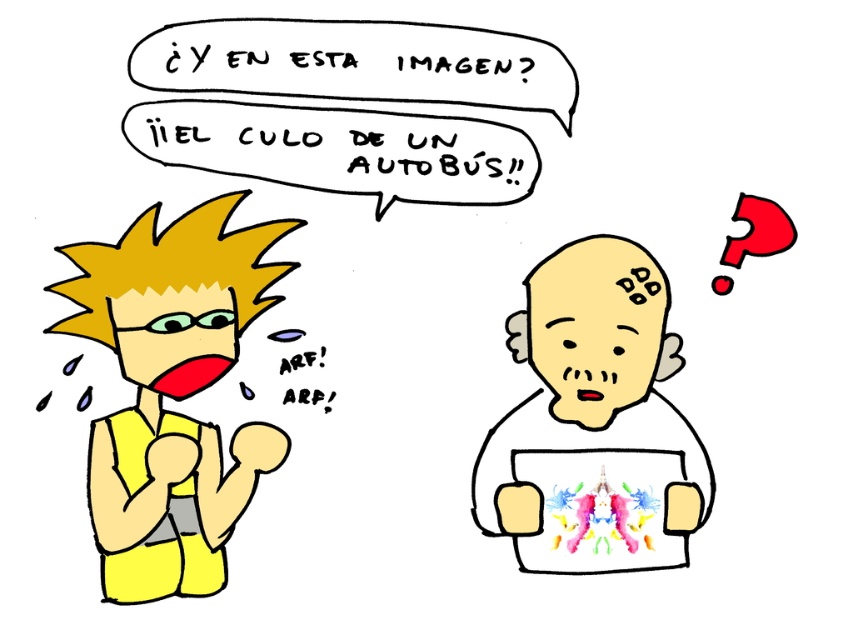
You are an AI analyzing the cartoon image. The scene has two characters. One is the character on the left with spiky yellow hair, and the other is the character on the right with a smooth beige head at center. Based on their positions, can you determine which character is closer to the bottom edge of the image?

The smooth beige head at center is located at point 0.698 on the vertical axis, which is closer to the bottom edge of the image compared to the character on the left.